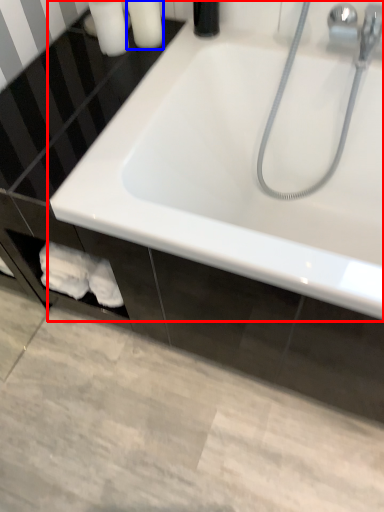
Question: Which point is further to the camera, bathtub (highlighted by a red box) or toiletry (highlighted by a blue box)?

Choices:
 (A) bathtub
 (B) toiletry

Answer: (B)